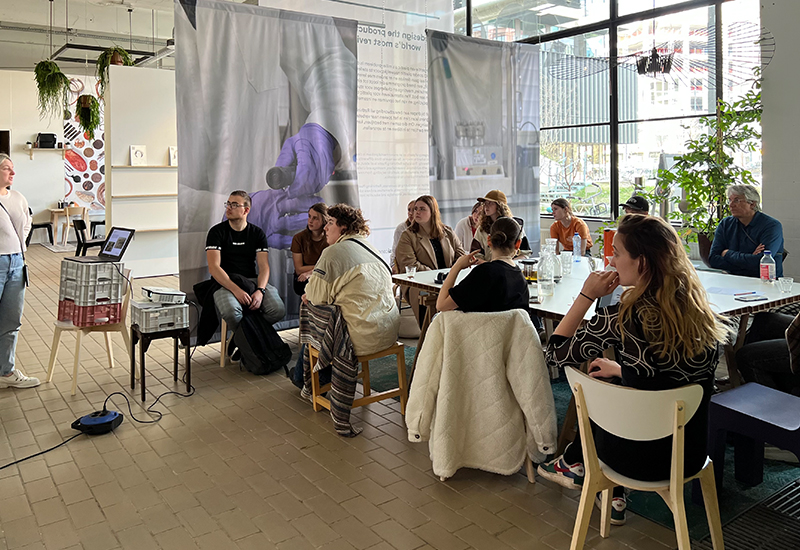
This screenshot has height=550, width=800. I want to click on laptop, so click(106, 257).